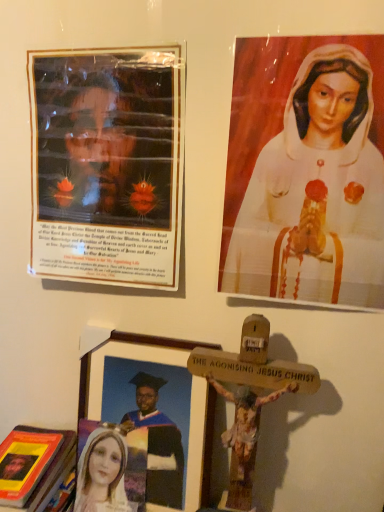
Question: Is there a large distance between matte plastic poster at upper left, marked as the 2th picture frame in a bottom-to-top arrangement, and wooden picture frame at lower center, which is the first picture frame in bottom-to-top order?

Choices:
 (A) yes
 (B) no

Answer: (B)

Question: Is matte plastic poster at upper left, marked as the 2th picture frame in a bottom-to-top arrangement, wider than wooden picture frame at lower center, which is the first picture frame in bottom-to-top order?

Choices:
 (A) no
 (B) yes

Answer: (A)

Question: From the image's perspective, is matte plastic poster at upper left, the first picture frame from the top, over wooden picture frame at lower center, which is the first picture frame in bottom-to-top order?

Choices:
 (A) yes
 (B) no

Answer: (A)

Question: Does matte plastic poster at upper left, marked as the 2th picture frame in a bottom-to-top arrangement, come in front of wooden picture frame at lower center, which is the first picture frame in bottom-to-top order?

Choices:
 (A) yes
 (B) no

Answer: (A)

Question: Is matte plastic poster at upper left, the first picture frame from the top, positioned beyond the bounds of wooden picture frame at lower center, the second picture frame viewed from the top?

Choices:
 (A) no
 (B) yes

Answer: (B)

Question: Considering the relative sizes of matte plastic poster at upper left, marked as the 2th picture frame in a bottom-to-top arrangement, and wooden picture frame at lower center, which is the first picture frame in bottom-to-top order, in the image provided, is matte plastic poster at upper left, marked as the 2th picture frame in a bottom-to-top arrangement, smaller than wooden picture frame at lower center, which is the first picture frame in bottom-to-top order,?

Choices:
 (A) no
 (B) yes

Answer: (B)

Question: Considering the relative sizes of hardcover book at lower left and white glossy statue at upper right in the image provided, is hardcover book at lower left shorter than white glossy statue at upper right?

Choices:
 (A) yes
 (B) no

Answer: (A)

Question: Is hardcover book at lower left taller than white glossy statue at upper right?

Choices:
 (A) yes
 (B) no

Answer: (B)

Question: Is hardcover book at lower left bigger than white glossy statue at upper right?

Choices:
 (A) yes
 (B) no

Answer: (A)

Question: Is hardcover book at lower left beside white glossy statue at upper right?

Choices:
 (A) yes
 (B) no

Answer: (B)

Question: Can you confirm if hardcover book at lower left is smaller than white glossy statue at upper right?

Choices:
 (A) yes
 (B) no

Answer: (B)

Question: Can white glossy statue at upper right be found inside hardcover book at lower left?

Choices:
 (A) no
 (B) yes

Answer: (A)

Question: Is hardcover book at lower left not within matte plastic poster at upper left, the first picture frame from the top?

Choices:
 (A) no
 (B) yes

Answer: (B)